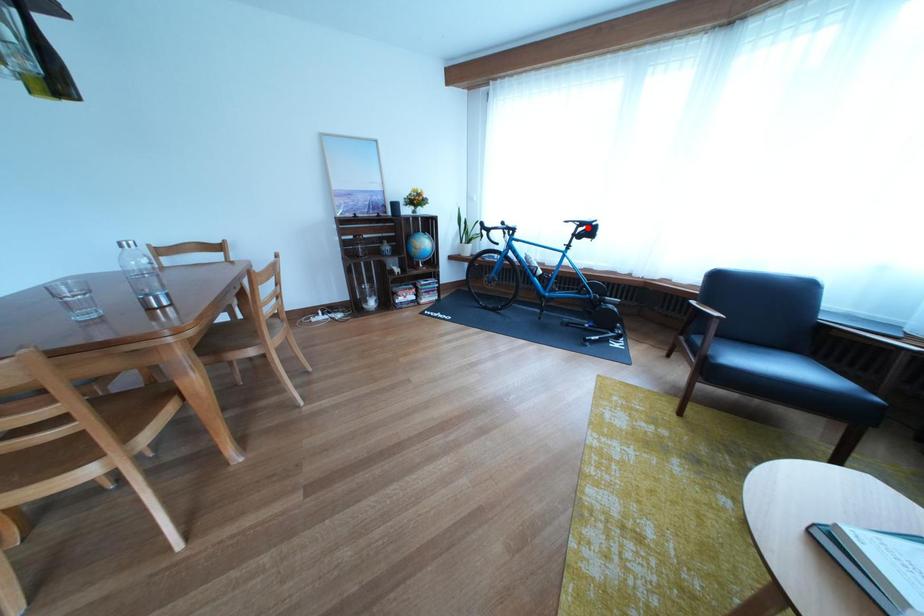
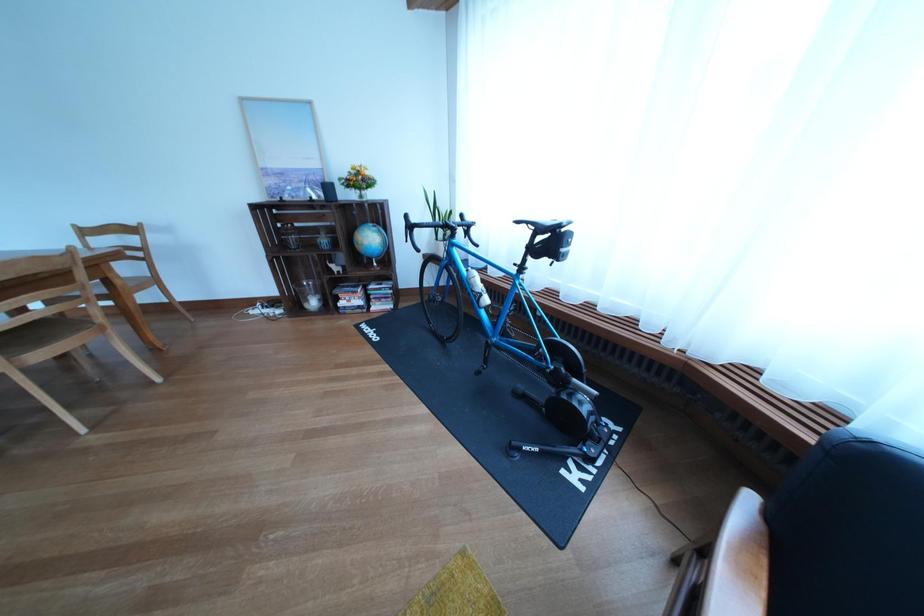
The point at the highlighted location is marked in the first image. Where is the corresponding point in the second image?

(541, 229)